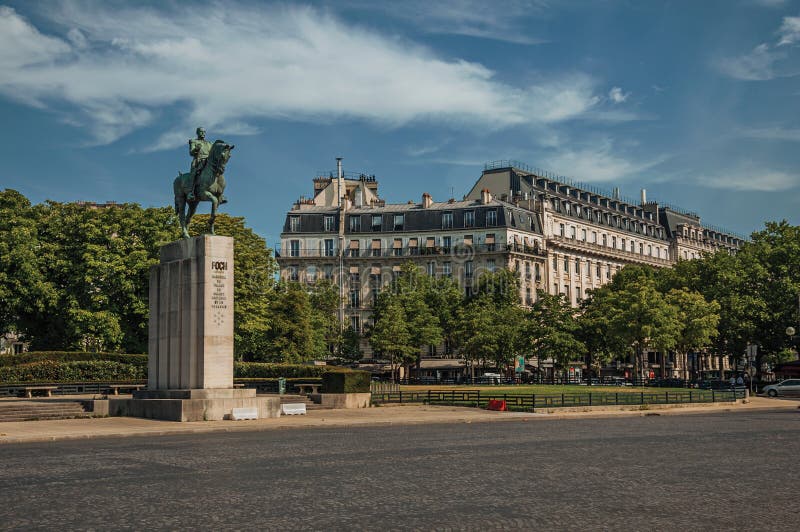
Identify the location of statue. Image resolution: width=800 pixels, height=532 pixels. (197, 185).